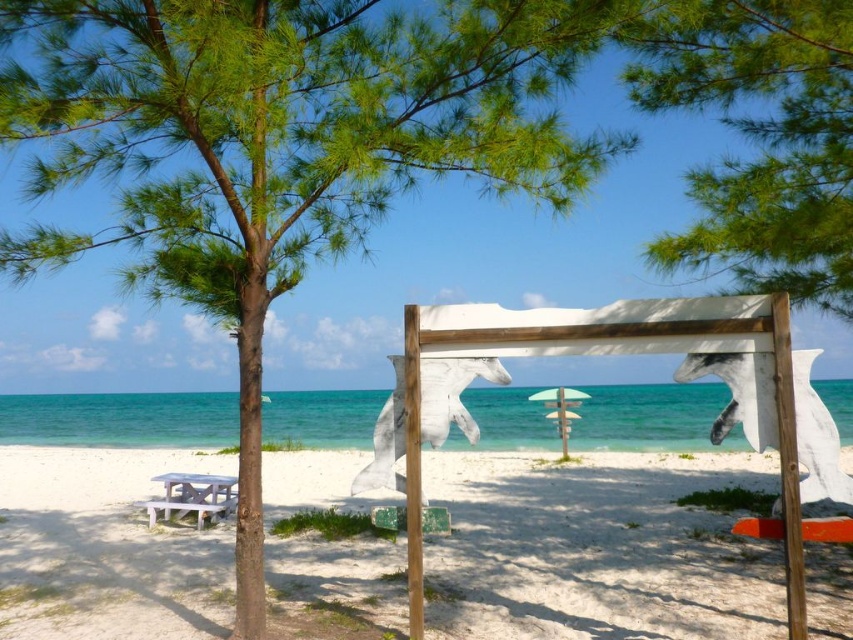
Is point (134, 460) behind point (727, 209)?

Yes, it is behind point (727, 209).

Is white wooden sign at center above green leafy tree at upper center?

Actually, white wooden sign at center is below green leafy tree at upper center.

Is point (90, 486) less distant than point (782, 225)?

No, (90, 486) is further to viewer.

Find the location of `white wooden sign at center`. white wooden sign at center is located at coordinates (596, 548).

Who is shorter, green leafy tree at upper center or white plastic bench at lower left?

white plastic bench at lower left is shorter.

In the scene shown: Can you confirm if green leafy tree at upper center is positioned to the left of white plastic bench at lower left?

In fact, green leafy tree at upper center is to the right of white plastic bench at lower left.

What are the coordinates of `green leafy tree at upper center` in the screenshot? It's located at (759, 138).

Where is `green leafy tree at upper center`? This screenshot has width=853, height=640. green leafy tree at upper center is located at coordinates (759, 138).

Which is in front, point (190, 483) or point (552, 396)?

Point (190, 483)

Which is below, white plastic bench at lower left or white plastic umbrella at center?

white plastic bench at lower left is below.

Between point (154, 506) and point (576, 394), which one is positioned behind?

The point (576, 394) is behind.

This screenshot has height=640, width=853. I want to click on white plastic bench at lower left, so click(x=192, y=497).